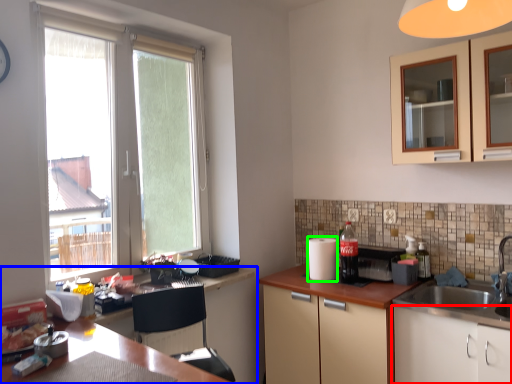
Question: Which is farther away from cabinetry (highlighted by a red box)? countertop (highlighted by a blue box) or appliance (highlighted by a green box)?

Choices:
 (A) countertop
 (B) appliance

Answer: (A)